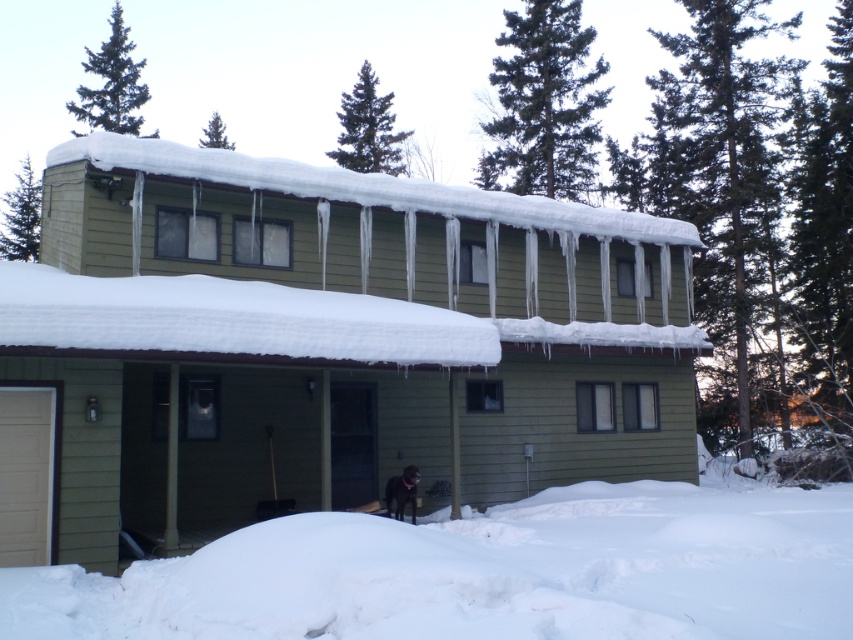
Is point (292, 593) behind point (523, 196)?

That is False.

Can you confirm if white fluffy snow at lower center is positioned to the left of snow-covered wood at upper center?

Incorrect, white fluffy snow at lower center is not on the left side of snow-covered wood at upper center.

Is point (666, 515) positioned behind point (624, 230)?

That is False.

Find the location of a particular element. The image size is (853, 640). white fluffy snow at lower center is located at coordinates (485, 572).